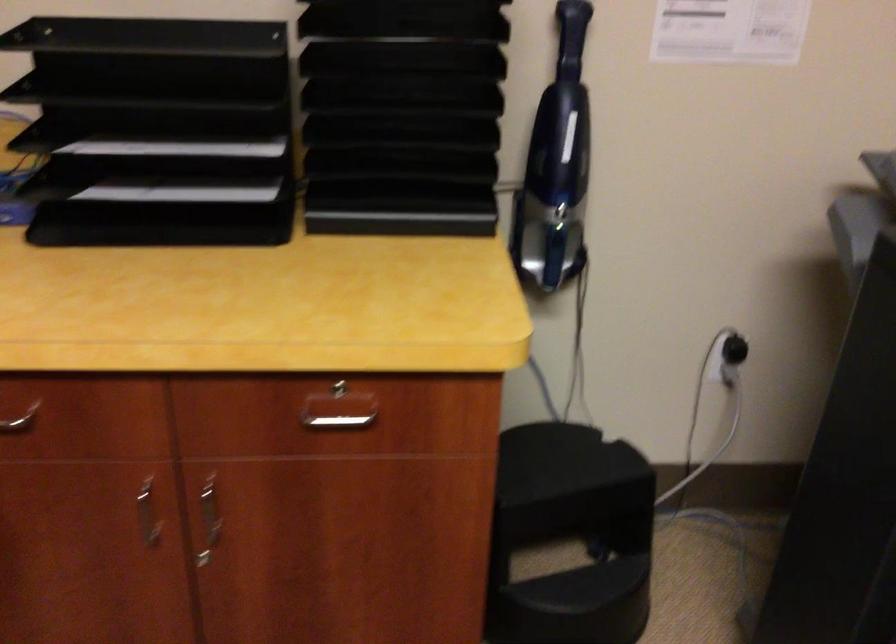
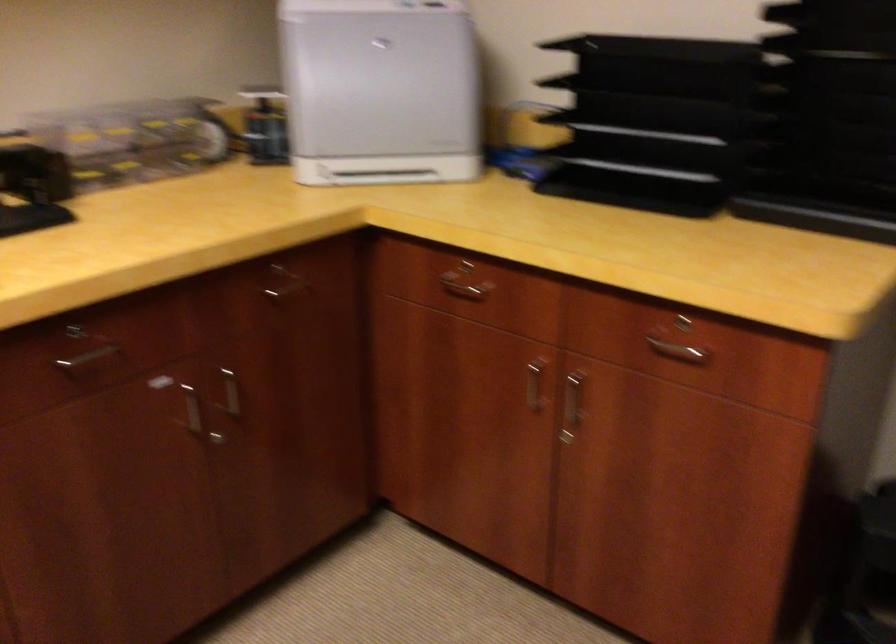
In the second image, find the point that corresponds to [138,154] in the first image.

(633, 142)